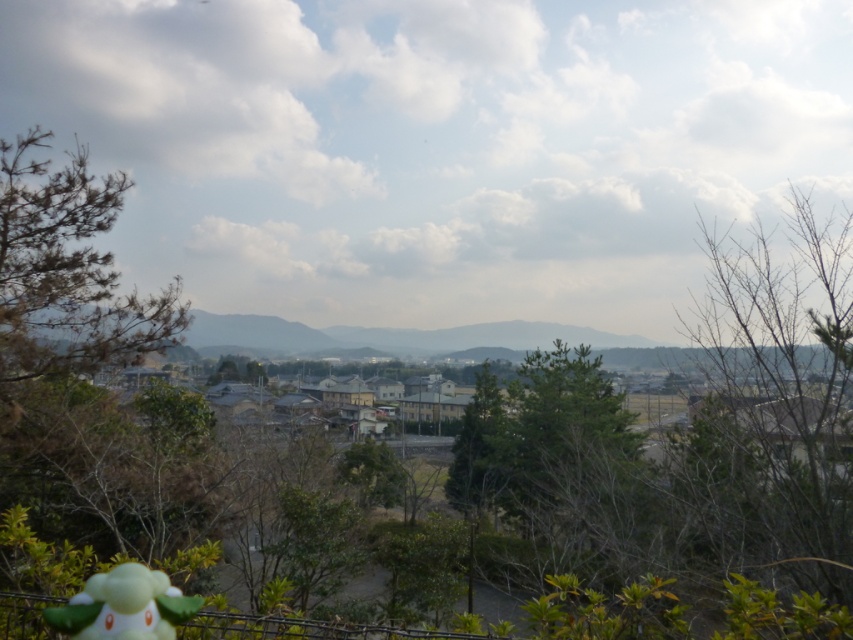
In the scene shown: You are a drone operator trying to capture a photo of the town from above. You notice two points marked on your screen at coordinates point (764, 552) and point (86, 618). Which point is closer to the camera lens?

Point (764, 552) is further to the viewer than point (86, 618), so the point closer to the camera lens would be point (86, 618).

You are an artist sketching the scene and want to accurately place the bare branches at upper right in your drawing. According to the coordinates provided, where should you position them on your canvas? Please specify the coordinates as a point in the format like 0.5, 0.5.

The bare branches at upper right should be positioned at coordinates (775, 404) on the canvas.

You are standing in the scenic town and want to take a photo that includes both the point at location (577,490) and the point at (143,568). Based on their positions, which point should be closer to the camera lens to ensure both are in focus?

Point (143,568) should be closer to the camera lens because it is in front of point (577,490), so focusing on it will keep both in focus.